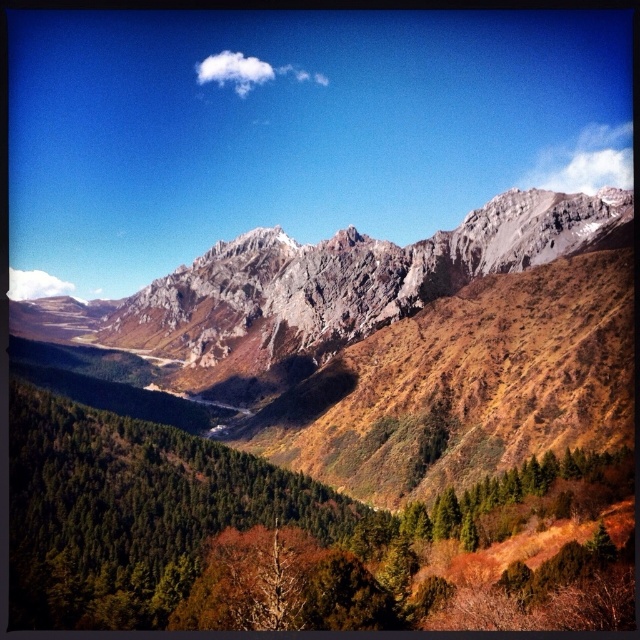
Question: Does rocky gray mountains at upper center appear under rocky gray mountain range at center?

Choices:
 (A) yes
 (B) no

Answer: (A)

Question: Which of the following is the closest to the observer?

Choices:
 (A) rocky gray mountains at upper center
 (B) rocky gray mountain range at center

Answer: (A)

Question: Can you confirm if rocky gray mountains at upper center is smaller than rocky gray mountain range at center?

Choices:
 (A) yes
 (B) no

Answer: (B)

Question: Is rocky gray mountains at upper center smaller than rocky gray mountain range at center?

Choices:
 (A) yes
 (B) no

Answer: (B)